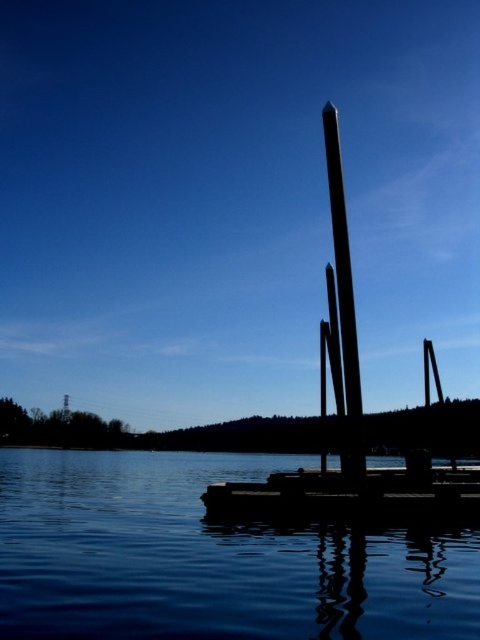
You are standing at the lakeside and looking at the scene. There are two points marked in the image. The first point is at coordinates point (105, 460) and the second is at point (344, 378). Which point is closer to you?

Point (105, 460) is further to the camera than point (344, 378), so the point closer to you is point (344, 378).

You are a drone operator trying to capture the reflection of the tall, slender structure in the transparent water at center. According to the coordinates provided, where should you position the drone to ensure the reflection is centered in your shot?

The transparent water at center is located at point (x=208, y=557), so positioning the drone at this coordinate will center the reflection in the shot.